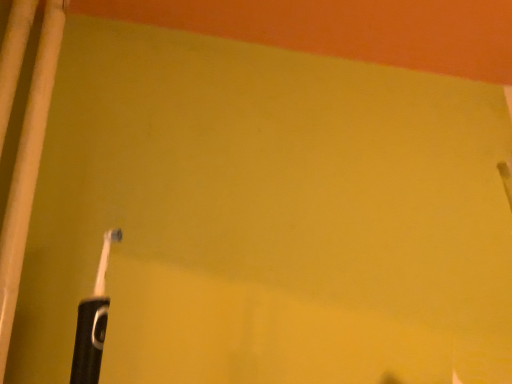
The image size is (512, 384). What do you see at coordinates (93, 322) in the screenshot?
I see `black rubber toothbrush at lower left` at bounding box center [93, 322].

Find the location of a particular element. This screenshot has width=512, height=384. black rubber toothbrush at lower left is located at coordinates (93, 322).

The image size is (512, 384). I want to click on black rubber toothbrush at lower left, so click(x=93, y=322).